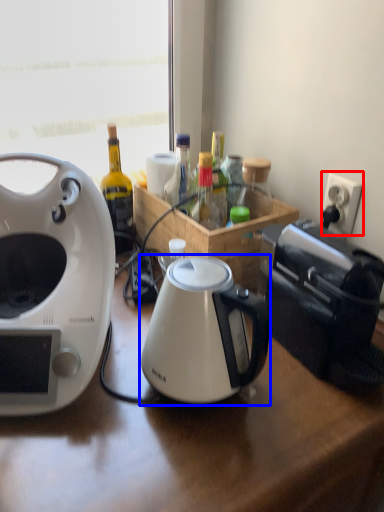
Question: Among these objects, which one is farthest to the camera, power outlet (highlighted by a red box) or kettle (highlighted by a blue box)?

Choices:
 (A) power outlet
 (B) kettle

Answer: (A)